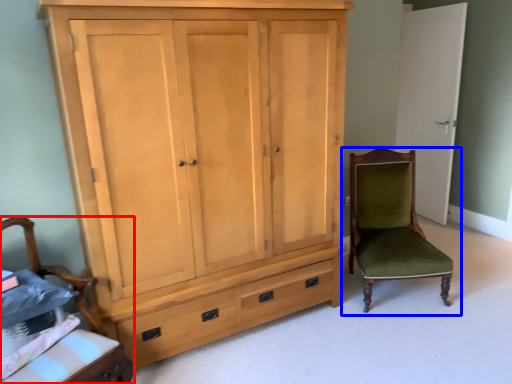
Question: Which of the following is the closest to the observer, chair (highlighted by a red box) or chair (highlighted by a blue box)?

Choices:
 (A) chair
 (B) chair

Answer: (A)